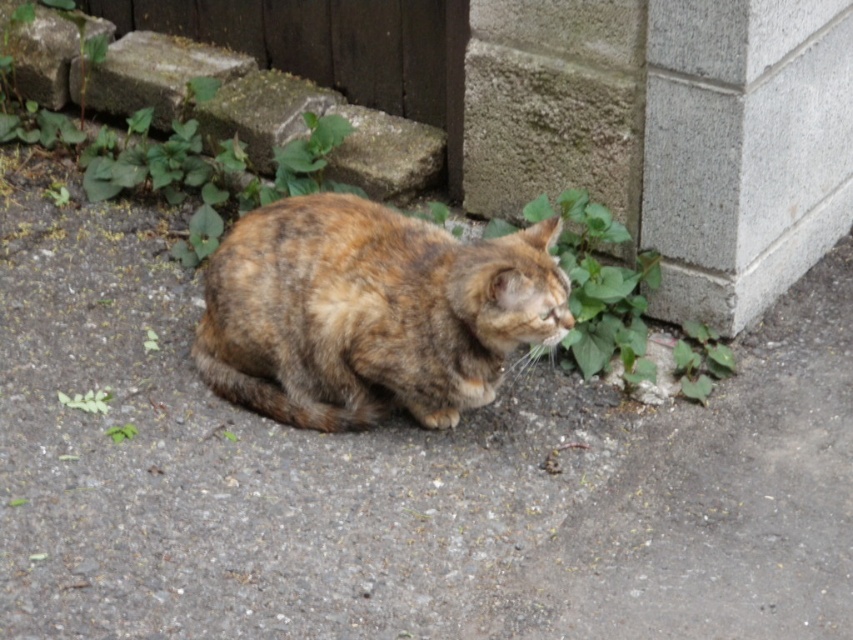
Question: Does gray rough concrete at lower right appear on the left side of tabby fur cat at center?

Choices:
 (A) no
 (B) yes

Answer: (A)

Question: Which point is farther to the camera?

Choices:
 (A) (491, 100)
 (B) (396, 403)

Answer: (A)

Question: Can you confirm if gray rough concrete at lower right is positioned to the left of tabby fur cat at center?

Choices:
 (A) no
 (B) yes

Answer: (A)

Question: Which point is closer to the camera?

Choices:
 (A) (724, 113)
 (B) (428, 234)

Answer: (B)

Question: Can you confirm if gray rough concrete at lower right is wider than tabby fur cat at center?

Choices:
 (A) yes
 (B) no

Answer: (A)

Question: Which object is farther from the camera taking this photo?

Choices:
 (A) tabby fur cat at center
 (B) gray rough concrete at lower right

Answer: (B)